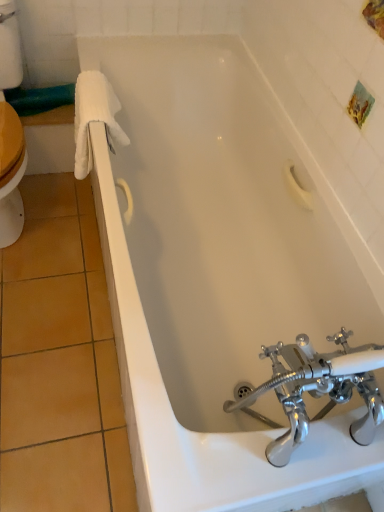
Question: Looking at the image, does polished chrome faucet at bottom right seem bigger or smaller compared to white fluffy towel at left?

Choices:
 (A) big
 (B) small

Answer: (A)

Question: Looking at their shapes, would you say polished chrome faucet at bottom right is wider or thinner than white fluffy towel at left?

Choices:
 (A) thin
 (B) wide

Answer: (B)

Question: In the image, is polished chrome faucet at bottom right on the left side or the right side of white fluffy towel at left?

Choices:
 (A) left
 (B) right

Answer: (B)

Question: Is white fluffy towel at left wider or thinner than polished chrome faucet at bottom right?

Choices:
 (A) thin
 (B) wide

Answer: (A)

Question: Is white fluffy towel at left taller or shorter than polished chrome faucet at bottom right?

Choices:
 (A) tall
 (B) short

Answer: (B)

Question: Is point (92, 90) positioned closer to the camera than point (291, 378)?

Choices:
 (A) closer
 (B) farther

Answer: (B)

Question: From a real-world perspective, relative to polished chrome faucet at bottom right, is white fluffy towel at left vertically above or below?

Choices:
 (A) below
 (B) above

Answer: (A)